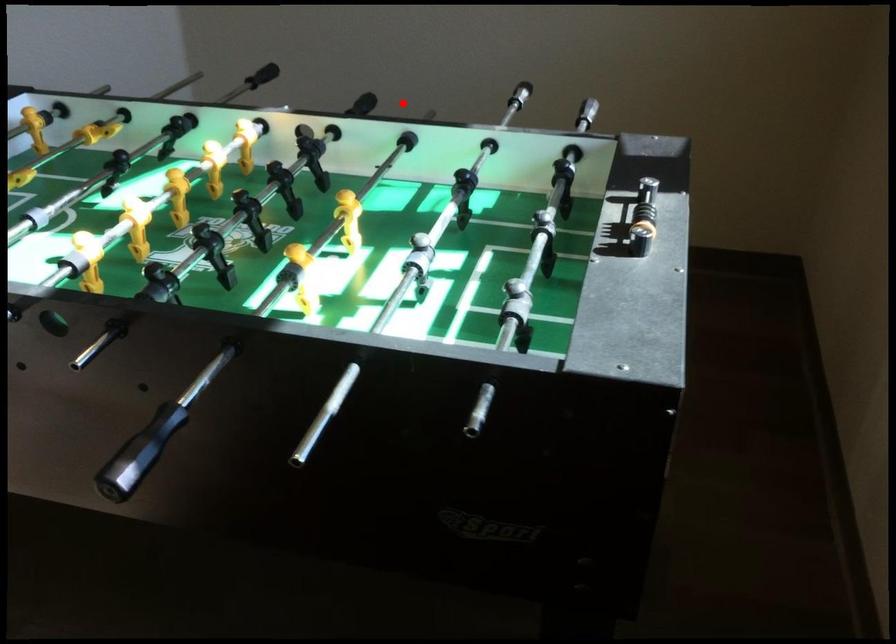
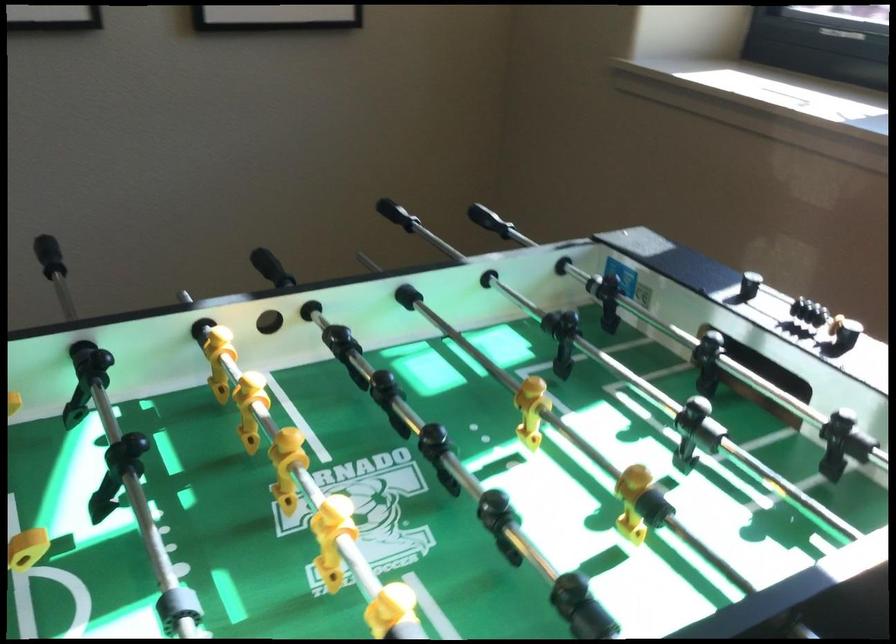
Find the pixel in the second image that matches the highlighted location in the first image.

(48, 256)